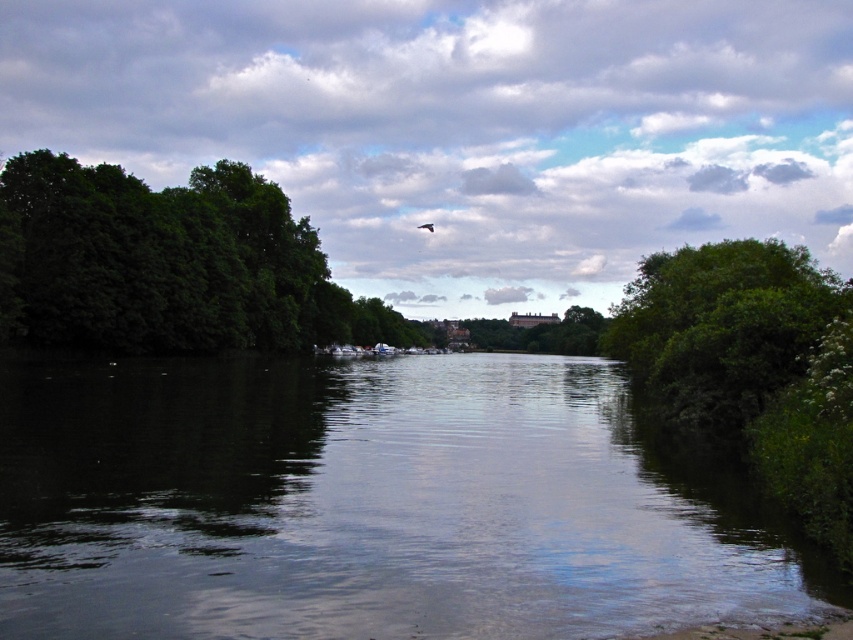
You are standing at the riverside and want to take a photo of the green leafy trees at left without the dark reflective water at center in the shot. How should you position yourself to achieve this?

To avoid including the dark reflective water at center in your photo, position yourself behind the green leafy trees at left so they block the view of the water.